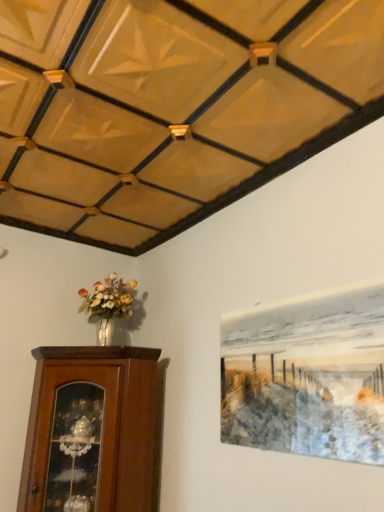
Question: Does brown wooden cabinet at lower left turn towards metallic silver painting at upper right?

Choices:
 (A) yes
 (B) no

Answer: (B)

Question: Can we say brown wooden cabinet at lower left lies outside metallic silver painting at upper right?

Choices:
 (A) no
 (B) yes

Answer: (B)

Question: Could metallic silver painting at upper right be considered to be inside brown wooden cabinet at lower left?

Choices:
 (A) yes
 (B) no

Answer: (B)

Question: Considering the relative sizes of brown wooden cabinet at lower left and metallic silver painting at upper right in the image provided, is brown wooden cabinet at lower left shorter than metallic silver painting at upper right?

Choices:
 (A) yes
 (B) no

Answer: (B)

Question: From the image's perspective, is brown wooden cabinet at lower left over metallic silver painting at upper right?

Choices:
 (A) yes
 (B) no

Answer: (B)

Question: Is brown wooden cabinet at lower left further to the viewer compared to metallic silver painting at upper right?

Choices:
 (A) no
 (B) yes

Answer: (B)

Question: Is metallic silver painting at upper right to the right of brown wooden cabinet at lower left from the viewer's perspective?

Choices:
 (A) yes
 (B) no

Answer: (A)

Question: Can you confirm if metallic silver painting at upper right is shorter than brown wooden cabinet at lower left?

Choices:
 (A) no
 (B) yes

Answer: (B)

Question: From a real-world perspective, is metallic silver painting at upper right over brown wooden cabinet at lower left?

Choices:
 (A) no
 (B) yes

Answer: (B)

Question: Could you tell me if metallic silver painting at upper right is turned towards brown wooden cabinet at lower left?

Choices:
 (A) no
 (B) yes

Answer: (A)

Question: From the image's perspective, is metallic silver painting at upper right located above brown wooden cabinet at lower left?

Choices:
 (A) no
 (B) yes

Answer: (B)

Question: Considering the relative positions of metallic silver painting at upper right and brown wooden cabinet at lower left in the image provided, is metallic silver painting at upper right to the left of brown wooden cabinet at lower left from the viewer's perspective?

Choices:
 (A) yes
 (B) no

Answer: (B)

Question: From a real-world perspective, is brown wooden cabinet at lower left physically located above or below metallic silver painting at upper right?

Choices:
 (A) below
 (B) above

Answer: (A)